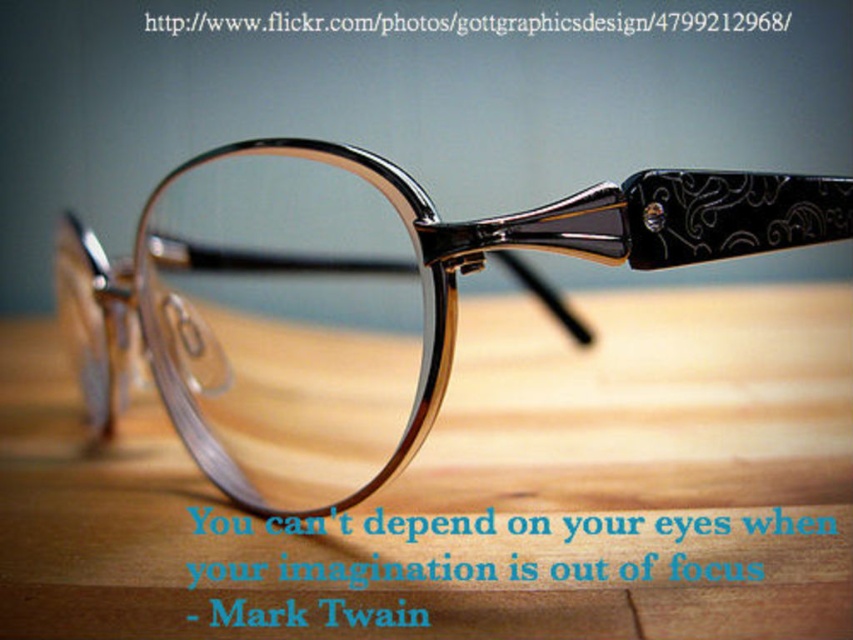
In the scene shown: Between wooden table at center and matte black glasses at center, which one has more height?

matte black glasses at center is taller.

Does point (190, 593) lie in front of point (94, 368)?

Yes, it is in front of point (94, 368).

You are a GUI agent. You are given a task and a screenshot of the screen. Output one action in this format:
    pyautogui.click(x=<x>, y=<y>)
    Task: Click on the wooden table at center
    
    Given the screenshot: What is the action you would take?
    pyautogui.click(x=480, y=486)